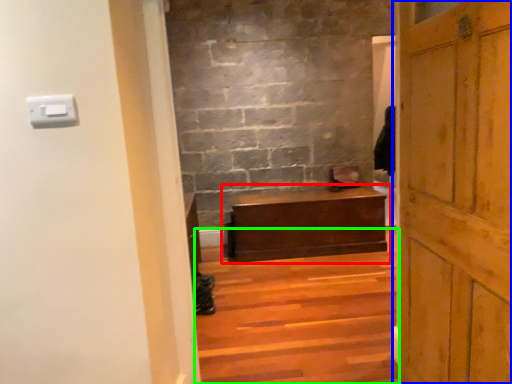
Question: Which object is positioned closest to table (highlighted by a red box)? Select from door (highlighted by a blue box) and stairs (highlighted by a green box).

Choices:
 (A) door
 (B) stairs

Answer: (B)